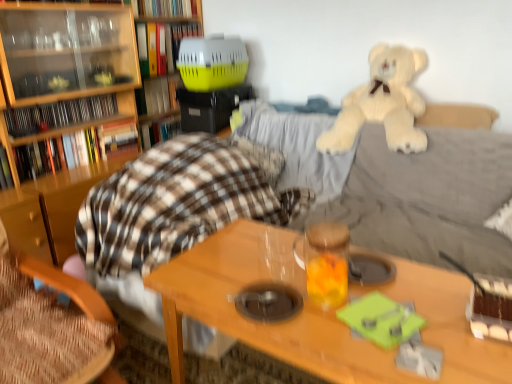
Question: Can you confirm if plaid fabric blanket at center, the fifth book positioned from the top, is wider than translucent glass jar at center?

Choices:
 (A) yes
 (B) no

Answer: (B)

Question: Would you say plaid fabric blanket at center, the third book positioned from the bottom, contains translucent glass jar at center?

Choices:
 (A) no
 (B) yes

Answer: (A)

Question: Is plaid fabric blanket at center, the fifth book positioned from the top, at the left side of translucent glass jar at center?

Choices:
 (A) yes
 (B) no

Answer: (A)

Question: From a real-world perspective, is plaid fabric blanket at center, the fifth book positioned from the top, located beneath translucent glass jar at center?

Choices:
 (A) no
 (B) yes

Answer: (B)

Question: From the image's perspective, is plaid fabric blanket at center, the third book positioned from the bottom, over translucent glass jar at center?

Choices:
 (A) yes
 (B) no

Answer: (A)

Question: Visually, is plaid fabric blanket at center, the third book positioned from the bottom, positioned to the left or to the right of wooden chair at lower left?

Choices:
 (A) right
 (B) left

Answer: (A)

Question: Based on their sizes in the image, would you say plaid fabric blanket at center, the third book positioned from the bottom, is bigger or smaller than wooden chair at lower left?

Choices:
 (A) big
 (B) small

Answer: (B)

Question: Is plaid fabric blanket at center, the fifth book positioned from the top, taller or shorter than wooden chair at lower left?

Choices:
 (A) tall
 (B) short

Answer: (B)

Question: Looking at their shapes, would you say plaid fabric blanket at center, the third book positioned from the bottom, is wider or thinner than wooden chair at lower left?

Choices:
 (A) wide
 (B) thin

Answer: (B)

Question: Choose the correct answer: Is hardcover book at left, acting as the 6th book starting from the top, inside wooden chair at lower left or outside it?

Choices:
 (A) outside
 (B) inside

Answer: (A)

Question: From the image's perspective, is hardcover book at left, acting as the 6th book starting from the top, located above or below wooden chair at lower left?

Choices:
 (A) below
 (B) above

Answer: (B)

Question: From their relative heights in the image, would you say hardcover book at left, acting as the 6th book starting from the top, is taller or shorter than wooden chair at lower left?

Choices:
 (A) tall
 (B) short

Answer: (B)

Question: Based on their positions, is hardcover book at left, acting as the 6th book starting from the top, located to the left or right of wooden chair at lower left?

Choices:
 (A) right
 (B) left

Answer: (B)

Question: Considering the positions of wooden table at center and hardcover book at left, acting as the 6th book starting from the top, in the image, is wooden table at center wider or thinner than hardcover book at left, acting as the 6th book starting from the top,?

Choices:
 (A) wide
 (B) thin

Answer: (A)

Question: Is wooden table at center situated inside hardcover book at left, acting as the 6th book starting from the top, or outside?

Choices:
 (A) inside
 (B) outside

Answer: (B)